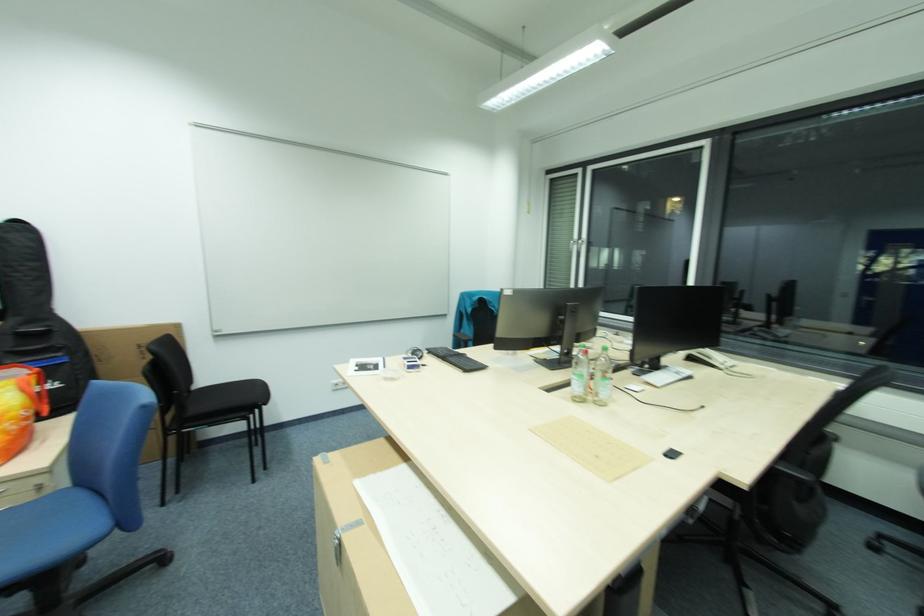
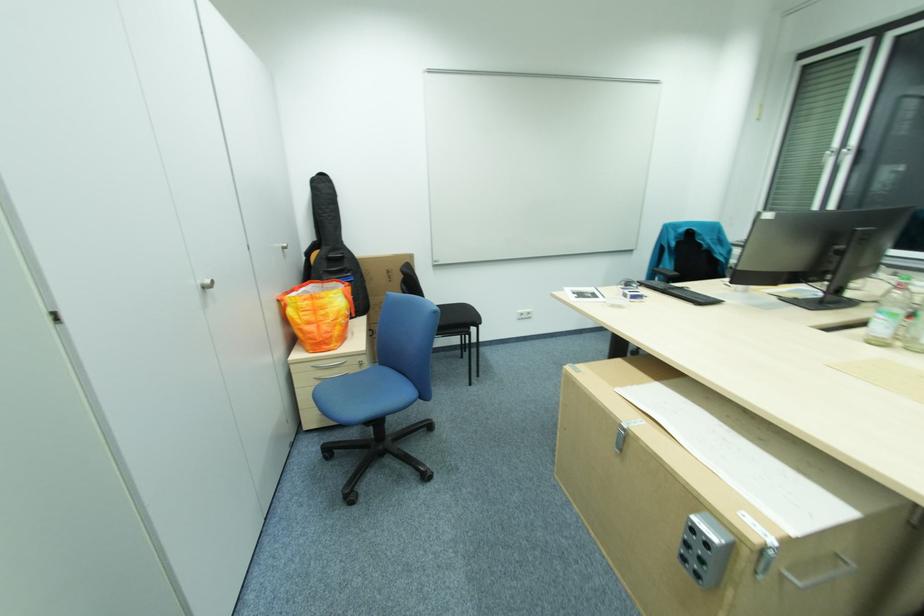
What movement of the cameraman would produce the second image?

The movement direction of the cameraman is left, backward.